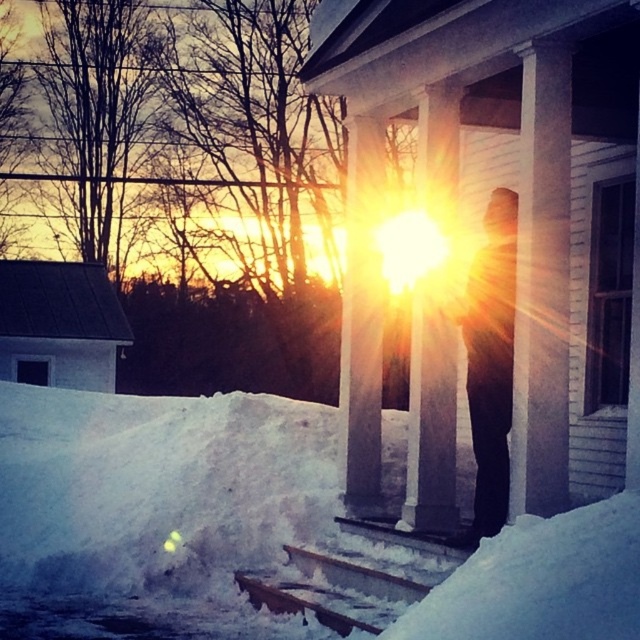
You are a photographer aiming to capture the black matte figure at center standing on the white powdery snow at lower left. Based on the scene description, can you confirm if the figure is indeed standing on the snow?

Yes, the white powdery snow at lower left is positioned under the black matte figure at center, so the figure is standing on the snow.